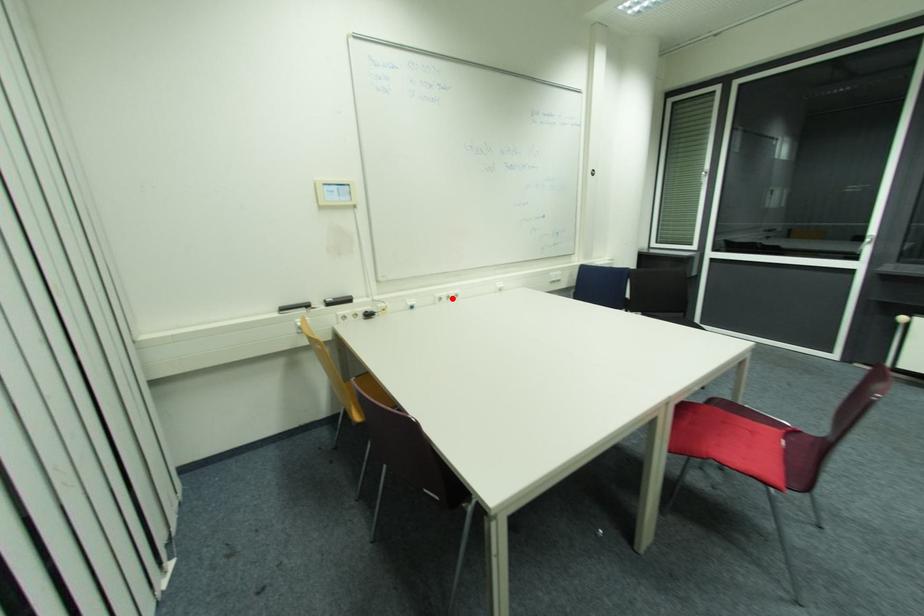
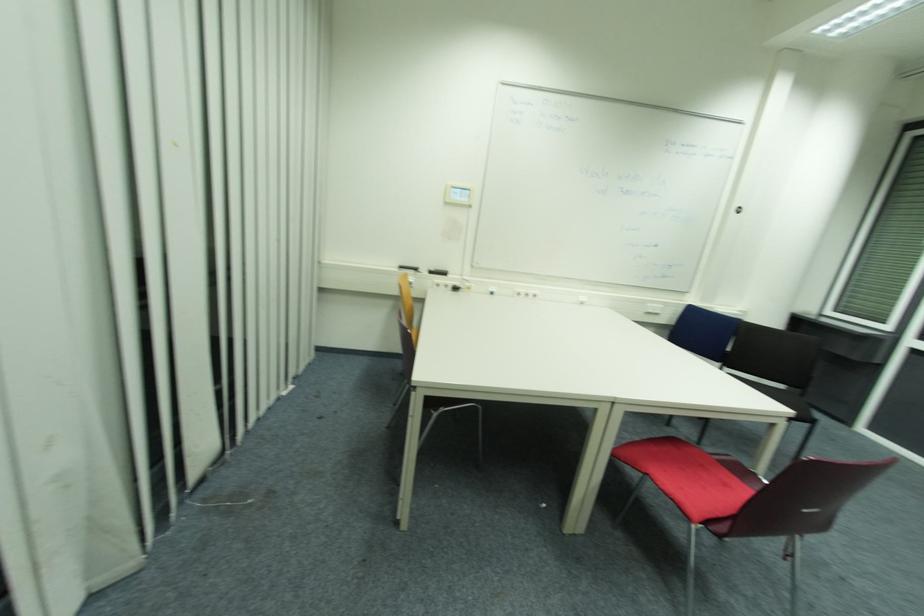
Where in the second image is the point corresponding to the highlighted location from the first image?

(529, 294)